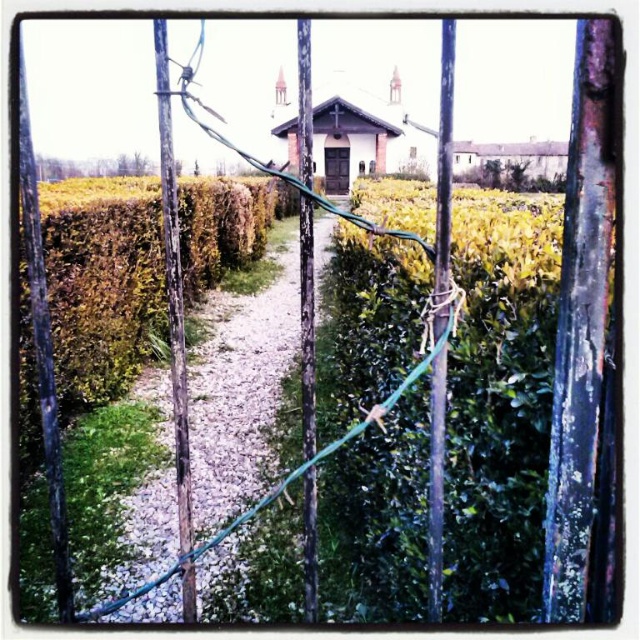
Which of these two, green leafy hedge at center or green gravel path at center, stands shorter?

green gravel path at center is shorter.

Who is positioned more to the left, green leafy hedge at center or green gravel path at center?

Positioned to the left is green leafy hedge at center.

Is point (86, 234) farther from camera compared to point (220, 456)?

Yes, point (86, 234) is behind point (220, 456).

This screenshot has height=640, width=640. Identify the location of green leafy hedge at center. (102, 284).